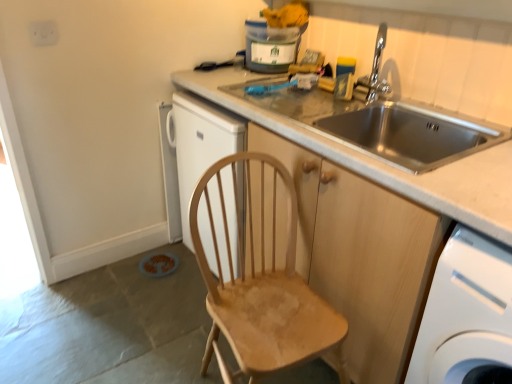
Question: Should I look upward or downward to see stainless steel sink at upper right?

Choices:
 (A) down
 (B) up

Answer: (B)

Question: Does white plastic washing machine at lower right lie in front of chrome metallic faucet at upper right?

Choices:
 (A) yes
 (B) no

Answer: (A)

Question: Is white plastic washing machine at lower right outside chrome metallic faucet at upper right?

Choices:
 (A) no
 (B) yes

Answer: (B)

Question: Considering the relative positions of white plastic washing machine at lower right and chrome metallic faucet at upper right in the image provided, is white plastic washing machine at lower right behind chrome metallic faucet at upper right?

Choices:
 (A) yes
 (B) no

Answer: (B)

Question: Considering the relative sizes of white plastic washing machine at lower right and chrome metallic faucet at upper right in the image provided, is white plastic washing machine at lower right shorter than chrome metallic faucet at upper right?

Choices:
 (A) no
 (B) yes

Answer: (A)

Question: Are white plastic washing machine at lower right and chrome metallic faucet at upper right located far from each other?

Choices:
 (A) no
 (B) yes

Answer: (A)

Question: Would you say chrome metallic faucet at upper right is part of white plastic washing machine at lower right's contents?

Choices:
 (A) no
 (B) yes

Answer: (A)

Question: Is chrome metallic faucet at upper right in front of white plastic washing machine at lower right?

Choices:
 (A) yes
 (B) no

Answer: (B)

Question: Can you confirm if chrome metallic faucet at upper right is taller than white plastic washing machine at lower right?

Choices:
 (A) yes
 (B) no

Answer: (B)

Question: Considering the relative sizes of chrome metallic faucet at upper right and white plastic washing machine at lower right in the image provided, is chrome metallic faucet at upper right bigger than white plastic washing machine at lower right?

Choices:
 (A) yes
 (B) no

Answer: (B)

Question: Can you confirm if chrome metallic faucet at upper right is thinner than white plastic washing machine at lower right?

Choices:
 (A) no
 (B) yes

Answer: (B)

Question: Is chrome metallic faucet at upper right to the right of white plastic washing machine at lower right from the viewer's perspective?

Choices:
 (A) yes
 (B) no

Answer: (B)

Question: Is chrome metallic faucet at upper right next to white plastic washing machine at lower right and touching it?

Choices:
 (A) yes
 (B) no

Answer: (B)

Question: Is the depth of wooden cabinet at center greater than that of stainless steel sink at upper right?

Choices:
 (A) yes
 (B) no

Answer: (B)